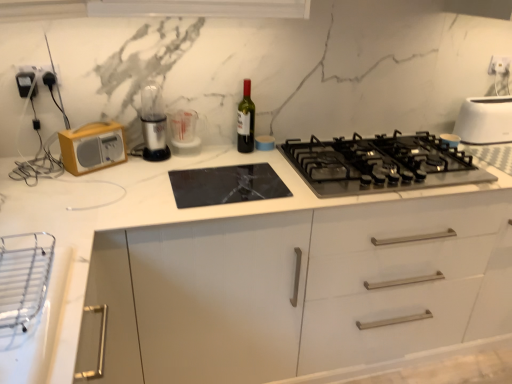
What do you see at coordinates (184, 132) in the screenshot? The width and height of the screenshot is (512, 384). I see `clear plastic measuring cup at center, acting as the second appliance starting from the top` at bounding box center [184, 132].

What do you see at coordinates (92, 147) in the screenshot?
I see `wooden radio at left` at bounding box center [92, 147].

The width and height of the screenshot is (512, 384). Identify the location of white plastic toaster at upper right. (485, 120).

This screenshot has width=512, height=384. Identify the location of matte black radio at left, arranged as the 2th appliance when ordered from the bottom. (24, 82).

This screenshot has height=384, width=512. What are the coordinates of `clear plastic measuring cup at center, which is the 2th appliance from left to right` in the screenshot? It's located at (184, 132).

From a real-world perspective, is clear plastic measuring cup at center, which is the first appliance from right to left, on top of green glass bottle at center?

No, from a real-world perspective, clear plastic measuring cup at center, which is the first appliance from right to left, is not over green glass bottle at center

Which is more to the right, clear plastic measuring cup at center, arranged as the first appliance when ordered from the bottom, or green glass bottle at center?

green glass bottle at center is more to the right.

From the image's perspective, is clear plastic measuring cup at center, which is the first appliance from right to left, above or below green glass bottle at center?

From the image's perspective, clear plastic measuring cup at center, which is the first appliance from right to left, appears below green glass bottle at center.

Considering the sizes of objects clear plastic measuring cup at center, which is the first appliance from right to left, and green glass bottle at center in the image provided, who is taller, clear plastic measuring cup at center, which is the first appliance from right to left, or green glass bottle at center?

green glass bottle at center.

Is wooden radio at left shorter than clear plastic measuring cup at center, which is the 2th appliance from left to right?

Yes, wooden radio at left is shorter than clear plastic measuring cup at center, which is the 2th appliance from left to right.

In the scene shown: Which object is further away from the camera, wooden radio at left or clear plastic measuring cup at center, the 1th appliance from the back?

clear plastic measuring cup at center, the 1th appliance from the back, is more distant.

Considering the sizes of wooden radio at left and clear plastic measuring cup at center, the 1th appliance from the back, in the image, is wooden radio at left bigger or smaller than clear plastic measuring cup at center, the 1th appliance from the back,?

Clearly, wooden radio at left is smaller in size than clear plastic measuring cup at center, the 1th appliance from the back.

How many degrees apart are the facing directions of wooden radio at left and clear plastic measuring cup at center, acting as the second appliance starting from the top?

They differ by 30.2 degrees in their facing directions.

From the image's perspective, would you say white plastic toaster at upper right is shown under matte black radio at left, arranged as the 2th appliance when ordered from the bottom?

Yes, from the image's perspective, white plastic toaster at upper right is below matte black radio at left, arranged as the 2th appliance when ordered from the bottom.

In the scene shown: Is matte black radio at left, arranged as the first appliance when viewed from the left, at the back of white plastic toaster at upper right?

white plastic toaster at upper right is not turned away from matte black radio at left, arranged as the first appliance when viewed from the left.

Between white plastic toaster at upper right and matte black radio at left, the first appliance positioned from the top, which one has smaller size?

Smaller between the two is matte black radio at left, the first appliance positioned from the top.

Is green glass bottle at center at the right side of white plastic electrical outlet at upper right?

Incorrect, green glass bottle at center is not on the right side of white plastic electrical outlet at upper right.

In the image, there is a white plastic electrical outlet at upper right. Identify the location of bottle below it (from the image's perspective). The image size is (512, 384). (246, 120).

Measure the distance from green glass bottle at center to white plastic electrical outlet at upper right.

They are 4.12 feet apart.

Looking at this image, considering the relative sizes of green glass bottle at center and white plastic electrical outlet at upper right in the image provided, is green glass bottle at center shorter than white plastic electrical outlet at upper right?

No, green glass bottle at center is not shorter than white plastic electrical outlet at upper right.

Where is `bottle behind the matte black radio at left, the first appliance positioned from the top`? The width and height of the screenshot is (512, 384). bottle behind the matte black radio at left, the first appliance positioned from the top is located at coordinates (246, 120).

Looking at the image, does green glass bottle at center seem bigger or smaller compared to matte black radio at left, the 1th appliance from the front?

Clearly, green glass bottle at center is larger in size than matte black radio at left, the 1th appliance from the front.

Between green glass bottle at center and matte black radio at left, arranged as the first appliance when viewed from the left, which one appears on the left side from the viewer's perspective?

matte black radio at left, arranged as the first appliance when viewed from the left.

From the image's perspective, which one is positioned lower, green glass bottle at center or matte black radio at left, the first appliance positioned from the top?

green glass bottle at center is shown below in the image.

In terms of width, does white plastic toaster at upper right look wider or thinner when compared to clear plastic measuring cup at center, acting as the second appliance starting from the top?

Clearly, white plastic toaster at upper right has more width compared to clear plastic measuring cup at center, acting as the second appliance starting from the top.

In the image, is white plastic toaster at upper right on the left side or the right side of clear plastic measuring cup at center, which is the 2th appliance from left to right?

white plastic toaster at upper right is positioned on clear plastic measuring cup at center, which is the 2th appliance from left to right,'s right side.

Is white plastic toaster at upper right bigger or smaller than clear plastic measuring cup at center, which is the 2th appliance from left to right?

Clearly, white plastic toaster at upper right is larger in size than clear plastic measuring cup at center, which is the 2th appliance from left to right.

How far apart are white plastic toaster at upper right and clear plastic measuring cup at center, which is the first appliance from right to left?

4.23 feet.

From a real-world perspective, is green glass bottle at center below black matte gas stove at center?

No, from a real-world perspective, green glass bottle at center is not below black matte gas stove at center.

Who is more distant, green glass bottle at center or black matte gas stove at center?

Positioned behind is green glass bottle at center.

Is green glass bottle at center far away from black matte gas stove at center?

No, green glass bottle at center is not far away from black matte gas stove at center.

Can you confirm if green glass bottle at center is shorter than black matte gas stove at center?

No.

This screenshot has height=384, width=512. In order to click on bottle on the right side of clear plastic measuring cup at center, arranged as the first appliance when ordered from the bottom in this screenshot , I will do `click(246, 120)`.

From the wooden radio at left, count 2nd appliances backward and point to it. Please provide its 2D coordinates.

[(184, 132)]

Looking at the image, which one is located further to white plastic electrical outlet at upper right, green glass bottle at center or wooden radio at left?

wooden radio at left.

Considering their positions, is matte black radio at left, arranged as the first appliance when viewed from the left, positioned closer to green glass bottle at center than wooden radio at left?

Among the two, wooden radio at left is located nearer to green glass bottle at center.

Looking at the image, which one is located closer to clear plastic measuring cup at center, the 1th appliance from the back, wooden radio at left or white plastic electrical outlet at upper right?

wooden radio at left is positioned closer to the anchor clear plastic measuring cup at center, the 1th appliance from the back.

From the image, which object appears to be farther from wooden radio at left, green glass bottle at center or white plastic toaster at upper right?

The object further to wooden radio at left is white plastic toaster at upper right.

When comparing their distances from clear plastic measuring cup at center, which is the first appliance from right to left, does white plastic toaster at upper right or black matte gas stove at center seem further?

white plastic toaster at upper right lies further to clear plastic measuring cup at center, which is the first appliance from right to left, than the other object.

Based on their spatial positions, is white plastic toaster at upper right or wooden radio at left closer to matte black radio at left, which appears as the 2th appliance when viewed from the back?

Based on the image, wooden radio at left appears to be nearer to matte black radio at left, which appears as the 2th appliance when viewed from the back.

Looking at the image, which one is located further to clear plastic measuring cup at center, the 1th appliance from the back, black matte gas stove at center or wooden radio at left?

black matte gas stove at center is further to clear plastic measuring cup at center, the 1th appliance from the back.

When comparing their distances from white plastic electrical outlet at upper right, does white plastic toaster at upper right or clear plastic measuring cup at center, which is the first appliance from right to left, seem further?

The object further to white plastic electrical outlet at upper right is clear plastic measuring cup at center, which is the first appliance from right to left.

Where is `gas stove between matte black radio at left, which is the second appliance from right to left, and white plastic toaster at upper right from left to right`? This screenshot has width=512, height=384. gas stove between matte black radio at left, which is the second appliance from right to left, and white plastic toaster at upper right from left to right is located at coordinates point(380,164).

Identify the location of toaster located between green glass bottle at center and white plastic electrical outlet at upper right in the left-right direction. coord(485,120).

Find the location of a particular element. The width and height of the screenshot is (512, 384). appliance between wooden radio at left and green glass bottle at center is located at coordinates (184, 132).

This screenshot has height=384, width=512. What are the coordinates of `bottle located between matte black radio at left, arranged as the first appliance when viewed from the left, and white plastic electrical outlet at upper right in the left-right direction` in the screenshot? It's located at tap(246, 120).